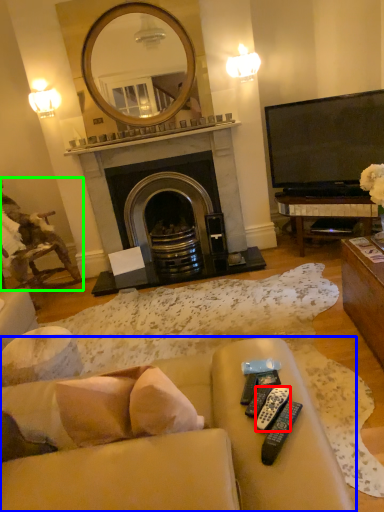
Question: Which object is the farthest from remote control (highlighted by a red box)? Choose among these: studio couch (highlighted by a blue box) or chair (highlighted by a green box).

Choices:
 (A) studio couch
 (B) chair

Answer: (B)